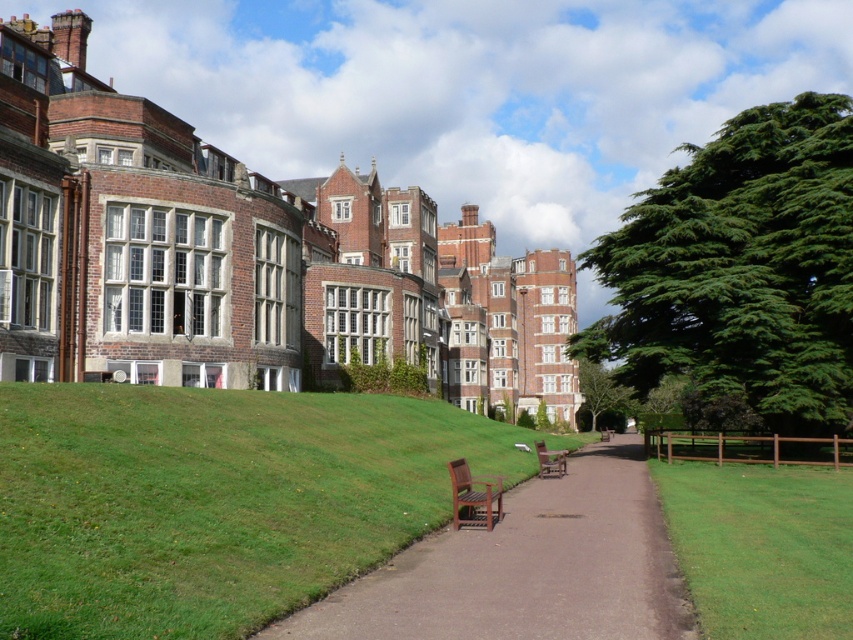
Question: Among these points, which one is nearest to the camera?

Choices:
 (A) (479, 520)
 (B) (489, 618)
 (C) (538, 458)

Answer: (B)

Question: Is green grass at lower left thinner than wooden park bench at center?

Choices:
 (A) yes
 (B) no

Answer: (B)

Question: Is green grass at lower left closer to the viewer compared to wooden park bench at center?

Choices:
 (A) yes
 (B) no

Answer: (A)

Question: Which is farther from the brown wooden bench at center?

Choices:
 (A) wooden park bench at center
 (B) teak wood bench at center
 (C) green grass at lower left

Answer: (A)

Question: Is green grass at lower left to the right of brown wooden bench at center from the viewer's perspective?

Choices:
 (A) yes
 (B) no

Answer: (B)

Question: Among these objects, which one is farthest from the camera?

Choices:
 (A) green grass at lower left
 (B) wooden park bench at center
 (C) teak wood bench at center
 (D) brown wooden bench at center

Answer: (B)